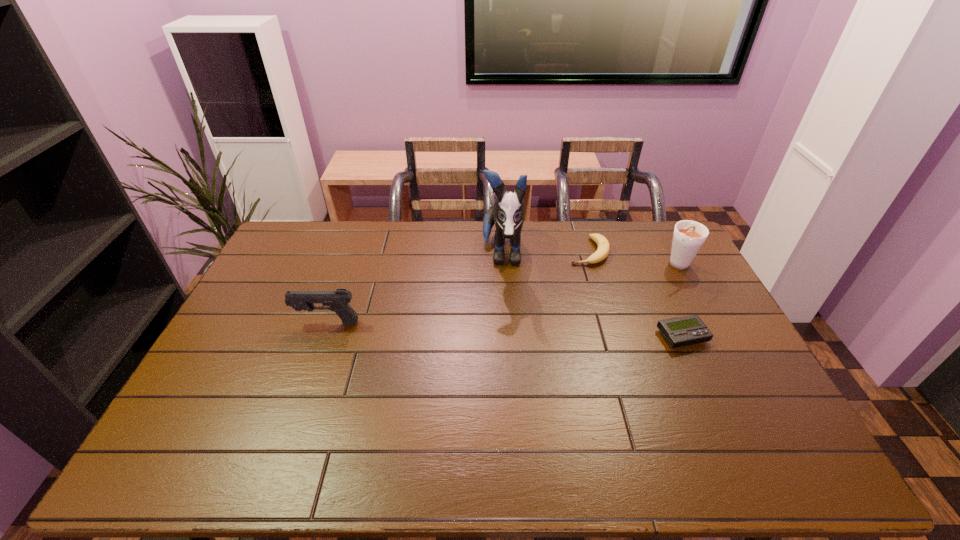
The image size is (960, 540). In order to click on object that can be found as the closest to the beeper in this screenshot , I will do `click(688, 237)`.

Select which object appears as the second closest to the puppy. Please provide its 2D coordinates. Your answer should be formatted as a tuple, i.e. [(x, y)], where the tuple contains the x and y coordinates of a point satisfying the conditions above.

[(683, 331)]

Where is `free spot that satisfies the following two spatial constraints: 1. on the front side of the second object from left to right; 2. on the right side of the beeper`? The image size is (960, 540). free spot that satisfies the following two spatial constraints: 1. on the front side of the second object from left to right; 2. on the right side of the beeper is located at coordinates (508, 336).